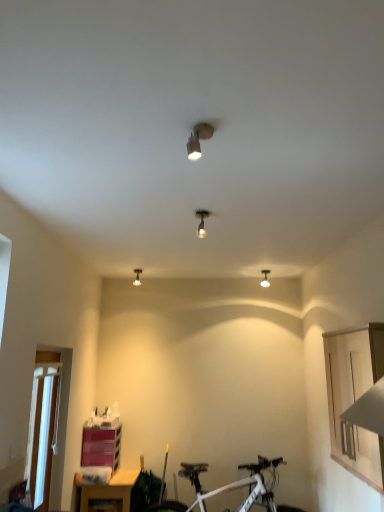
Question: From a real-world perspective, is matte silver spotlight at center, the second light fixture positioned from the right, positioned over matte white light fixture at upper center, placed as the fourth light fixture when sorted from left to right, based on gravity?

Choices:
 (A) no
 (B) yes

Answer: (B)

Question: From a real-world perspective, is matte silver spotlight at center, the second light fixture when ordered from front to back, below matte white light fixture at upper center, the first light fixture in the bottom-to-top sequence?

Choices:
 (A) no
 (B) yes

Answer: (A)

Question: Are matte silver spotlight at center, the second light fixture when ordered from front to back, and matte white light fixture at upper center, the first light fixture in the bottom-to-top sequence, far apart?

Choices:
 (A) yes
 (B) no

Answer: (A)

Question: Is matte silver spotlight at center, the second light fixture when ordered from front to back, thinner than matte white light fixture at upper center, marked as the 2th light fixture in a back-to-front arrangement?

Choices:
 (A) no
 (B) yes

Answer: (A)

Question: From the image's perspective, would you say matte silver spotlight at center, the 3th light fixture when ordered from back to front, is shown under matte white light fixture at upper center, the 4th light fixture positioned from the top?

Choices:
 (A) no
 (B) yes

Answer: (A)

Question: Is the position of matte silver spotlight at center, the second light fixture when ordered from front to back, less distant than that of matte white light fixture at upper center, the 4th light fixture positioned from the top?

Choices:
 (A) no
 (B) yes

Answer: (B)

Question: Does white matte bicycle at lower center have a lesser width compared to matte silver spotlight at center, the second light fixture positioned from the right?

Choices:
 (A) yes
 (B) no

Answer: (B)

Question: Does white matte bicycle at lower center have a greater width compared to matte silver spotlight at center, the second light fixture positioned from the right?

Choices:
 (A) no
 (B) yes

Answer: (B)

Question: Is white matte bicycle at lower center not inside matte silver spotlight at center, the 3th light fixture when ordered from back to front?

Choices:
 (A) yes
 (B) no

Answer: (A)

Question: From the image's perspective, is white matte bicycle at lower center beneath matte silver spotlight at center, the 3th light fixture in the left-to-right sequence?

Choices:
 (A) yes
 (B) no

Answer: (A)

Question: From a real-world perspective, is white matte bicycle at lower center physically below matte silver spotlight at center, the second light fixture positioned from the right?

Choices:
 (A) no
 (B) yes

Answer: (B)

Question: Are white matte bicycle at lower center and matte silver spotlight at center, the second light fixture positioned from the right, located far from each other?

Choices:
 (A) yes
 (B) no

Answer: (A)

Question: From the image's perspective, does matte silver spotlight at upper center, the fourth light fixture ordered from the bottom, appear higher than matte white light fixture at upper center, the 4th light fixture positioned from the top?

Choices:
 (A) yes
 (B) no

Answer: (A)